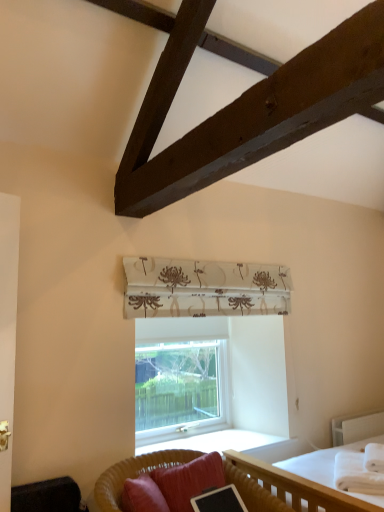
Question: In terms of size, does woven rattan studio couch at lower center appear bigger or smaller than velvet black swivel chair at lower left?

Choices:
 (A) big
 (B) small

Answer: (A)

Question: Looking at their shapes, would you say woven rattan studio couch at lower center is wider or thinner than velvet black swivel chair at lower left?

Choices:
 (A) thin
 (B) wide

Answer: (B)

Question: Based on their relative distances, which object is farther from the white wooden bed at lower right?

Choices:
 (A) velvet red pillow at lower center
 (B) white soft blanket at lower right
 (C) clear glass window at center
 (D) woven rattan studio couch at lower center
 (E) velvet black swivel chair at lower left

Answer: (C)

Question: Considering the real-world distances, which object is farthest from the velvet red pillow at lower center?

Choices:
 (A) white wooden bed at lower right
 (B) woven rattan studio couch at lower center
 (C) clear glass window at center
 (D) white textured balustrade at lower right
 (E) velvet black swivel chair at lower left

Answer: (D)